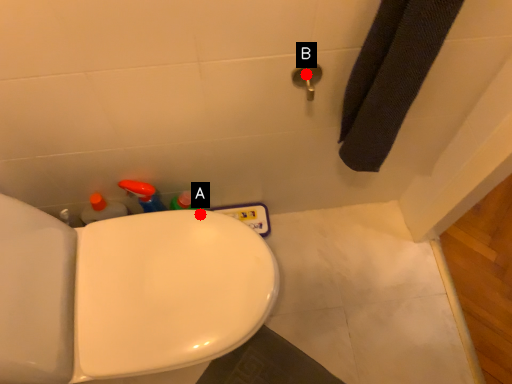
Question: Two points are circled on the image, labeled by A and B beside each circle. Among these points, which one is nearest to the camera?

Choices:
 (A) A is closer
 (B) B is closer

Answer: (B)